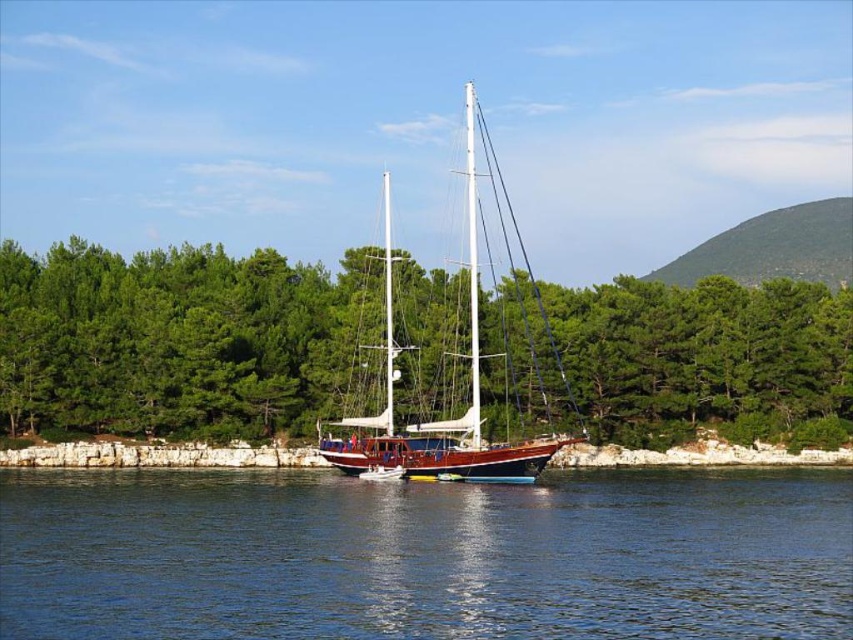
Measure the distance between point (704, 579) and camera.

They are 37.20 meters apart.

In the scene shown: Can you confirm if blue water at center is bigger than green leafy trees at center?

Incorrect, blue water at center is not larger than green leafy trees at center.

Is point (42, 573) positioned behind point (161, 422)?

No, (42, 573) is closer to viewer.

This screenshot has height=640, width=853. I want to click on blue water at center, so click(x=425, y=556).

Between point (816, 364) and point (473, 236), which one is positioned in front?

Point (816, 364) is more forward.

Is green leafy trees at center above wooden sailboat at center?

Incorrect, green leafy trees at center is not positioned above wooden sailboat at center.

Is point (701, 346) less distant than point (390, 444)?

No, (701, 346) is further to viewer.

Identify the location of green leafy trees at center. This screenshot has height=640, width=853. (171, 340).

Is blue water at center smaller than wooden sailboat at center?

Yes, blue water at center is smaller than wooden sailboat at center.

Who is lower down, blue water at center or wooden sailboat at center?

blue water at center is below.

Is point (1, 547) closer to viewer compared to point (389, 236)?

Yes, it is in front of point (389, 236).

At what (x,y) coordinates should I click in order to perform the action: click on blue water at center. Please return your answer as a coordinate pair (x, y). This screenshot has height=640, width=853. Looking at the image, I should click on (425, 556).